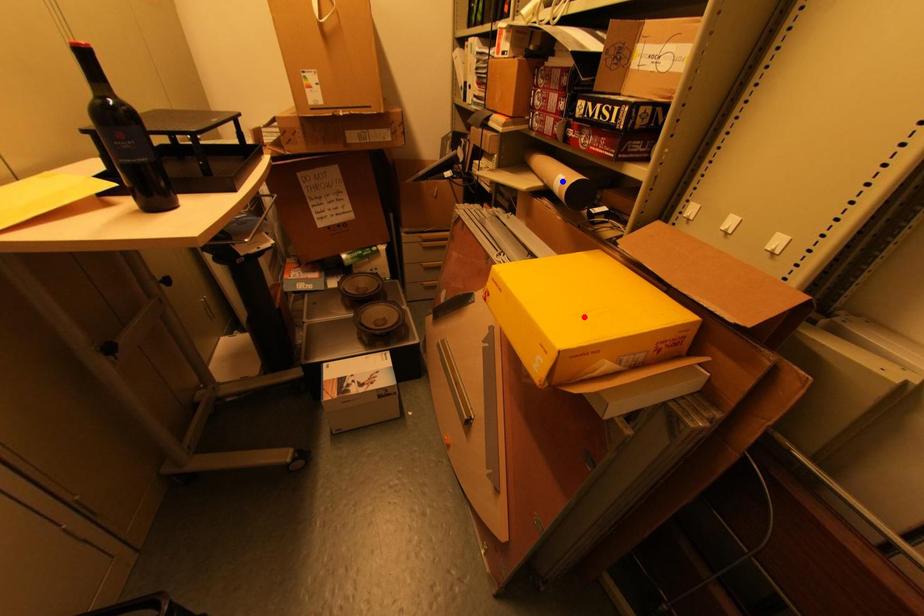
Question: Two points are marked on the image. Which point is closer to the camera?

Choices:
 (A) Blue point is closer.
 (B) Red point is closer.

Answer: (B)